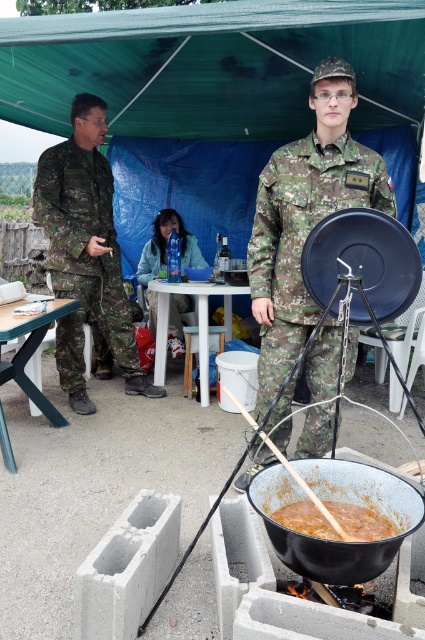
You are a photographer trying to capture the camouflage fabric uniform at center in a closeup shot. Based on its position coordinates, can you estimate whether it will be in the center of the frame or off to one side?

The camouflage fabric uniform at center is positioned at coordinates point [302,236], which is slightly to the left and lower than the exact center of the frame. Therefore, it will appear off to the left side rather than being perfectly centered.

You are a photographer setting up a shot of the camouflage fabric uniform at center and the green plastic picnic table at lower left. Which object should you frame wider in your camera to capture its full size?

The camouflage fabric uniform at center should be framed wider because its width surpasses the green plastic picnic table at lower left.